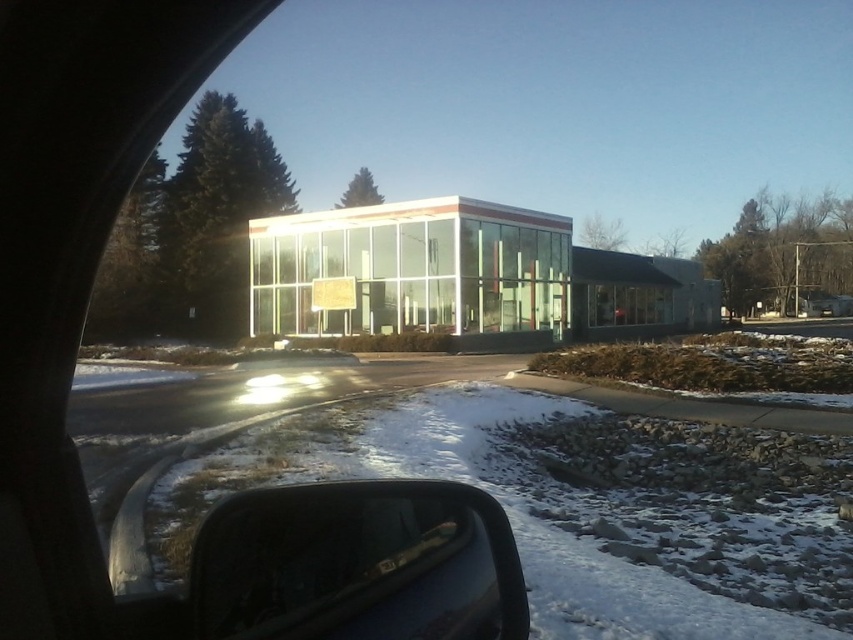
You are a passenger in the car and notice the white powdery snow at lower left and the transparent glass side mirror at lower left. Which object is closer to the bottom edge of the car window?

The white powdery snow at lower left is closer to the bottom edge of the car window because it is positioned below the transparent glass side mirror at lower left.

In the scene shown: You are sitting in the driver seat of the car and notice both the white powdery snow at lower left and the transparent glass side mirror at lower left. Which object is closer to you?

The white powdery snow at lower left is closer to you because it is further to the viewer than the transparent glass side mirror at lower left.

You are a passenger in the car and notice the white powdery snow at lower left and the transparent glass side mirror at lower left. Which object is closer to you?

The white powdery snow at lower left is closer to you because it has a smaller size compared to the transparent glass side mirror at lower left, which suggests it is farther away.